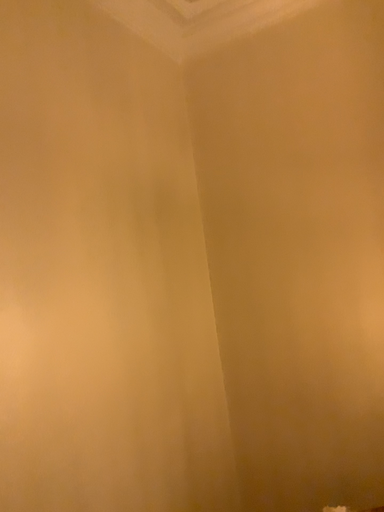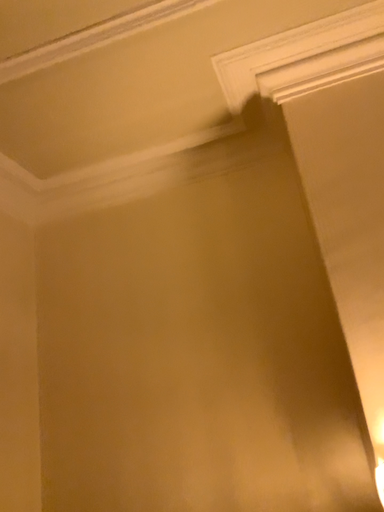
Question: How did the camera likely rotate when shooting the video?

Choices:
 (A) rotated upward
 (B) rotated downward

Answer: (A)